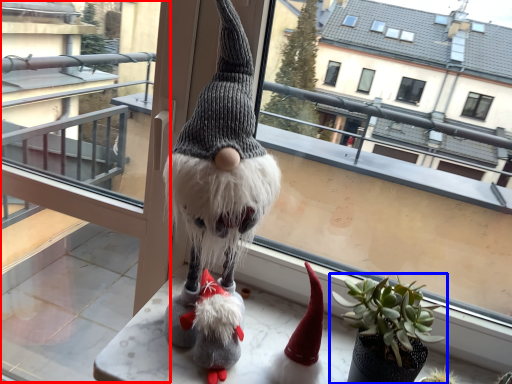
Question: Among these objects, which one is farthest to the camera, glass door (highlighted by a red box) or houseplant (highlighted by a blue box)?

Choices:
 (A) glass door
 (B) houseplant

Answer: (A)